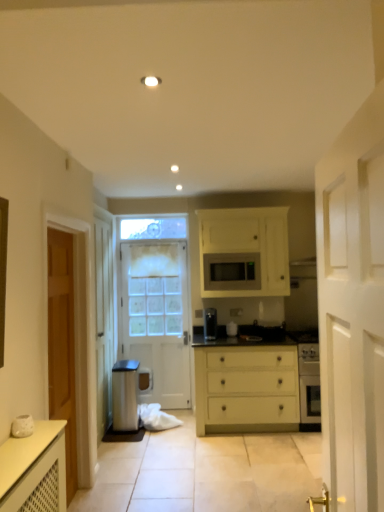
The width and height of the screenshot is (384, 512). Identify the location of vacant area that is in front of matte yellow chest of drawers at center. (234, 458).